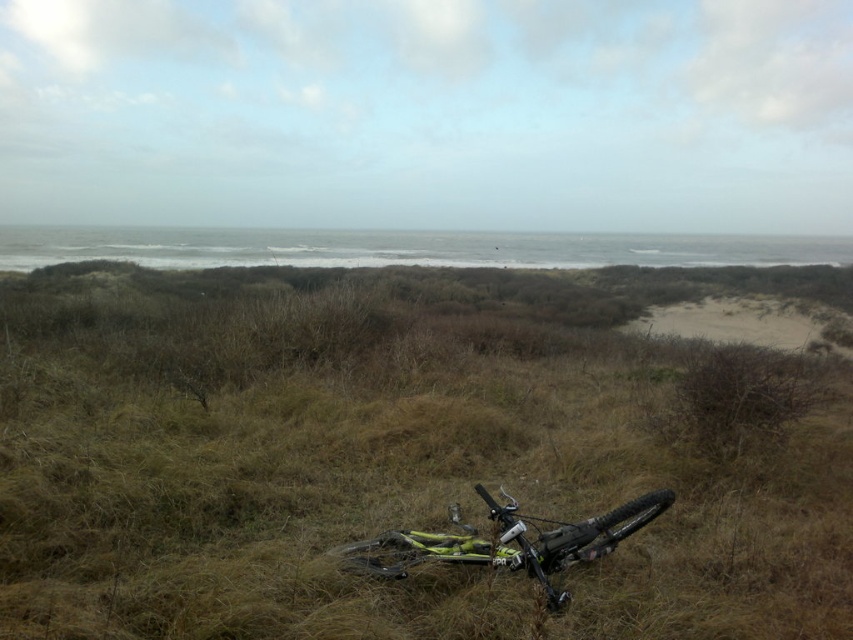
Who is positioned more to the right, green matte grass at center or yellow matte bicycle at center?

From the viewer's perspective, green matte grass at center appears more on the right side.

What do you see at coordinates (405, 452) in the screenshot?
I see `green matte grass at center` at bounding box center [405, 452].

The height and width of the screenshot is (640, 853). Identify the location of green matte grass at center. (405, 452).